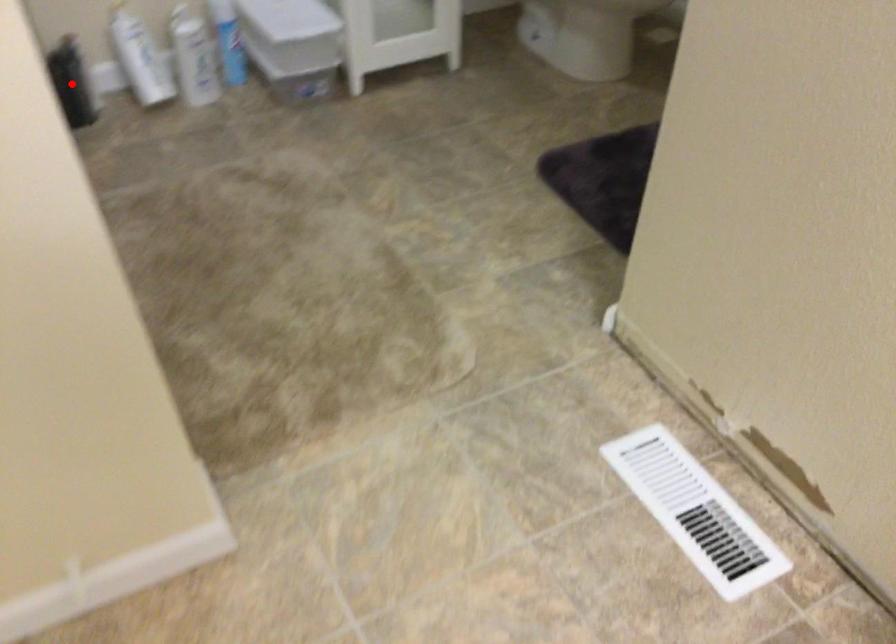
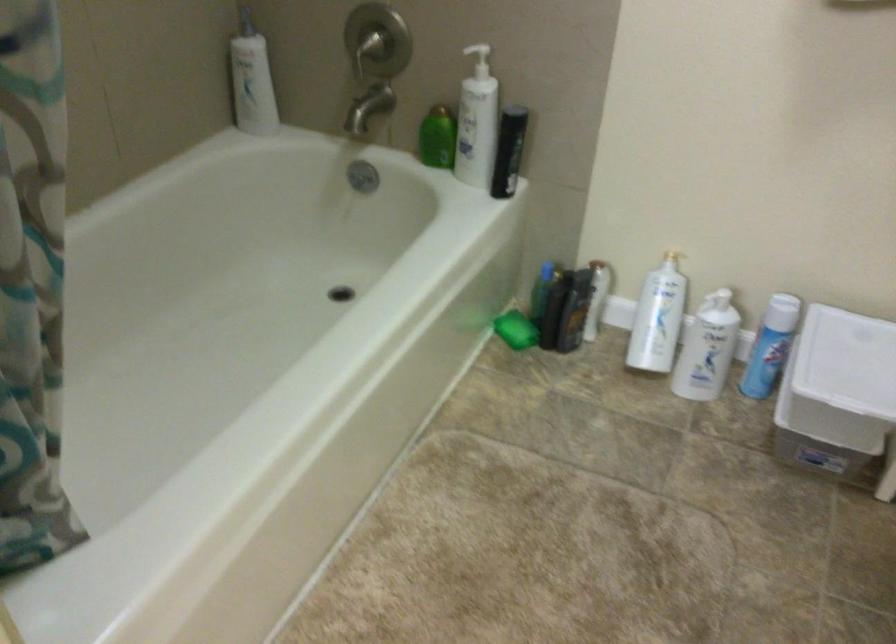
Question: A red point is marked in image1. In image2, is the corresponding 3D point closer to the camera or farther? Reply with the corresponding letter.

Choices:
 (A) The corresponding 3D point is closer.
 (B) The corresponding 3D point is farther.

Answer: (A)